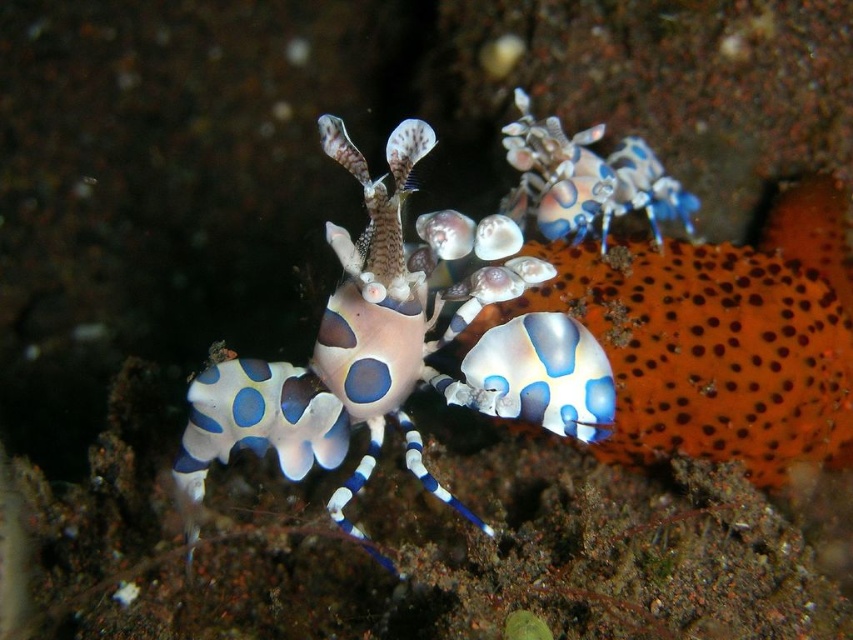
Question: Is translucent blue and white spotted shrimp at center below shiny blue and white shrimp at center?

Choices:
 (A) yes
 (B) no

Answer: (A)

Question: Which object appears farthest from the camera in this image?

Choices:
 (A) shiny blue and white shrimp at center
 (B) translucent blue and white spotted shrimp at center

Answer: (A)

Question: In this image, where is translucent blue and white spotted shrimp at center located relative to shiny blue and white shrimp at center?

Choices:
 (A) below
 (B) above

Answer: (A)

Question: Is translucent blue and white spotted shrimp at center below shiny blue and white shrimp at center?

Choices:
 (A) no
 (B) yes

Answer: (B)

Question: Among these points, which one is nearest to the camera?

Choices:
 (A) (625, 176)
 (B) (407, 454)

Answer: (B)

Question: Which of the following is the closest to the observer?

Choices:
 (A) click(x=363, y=289)
 (B) click(x=619, y=211)

Answer: (A)